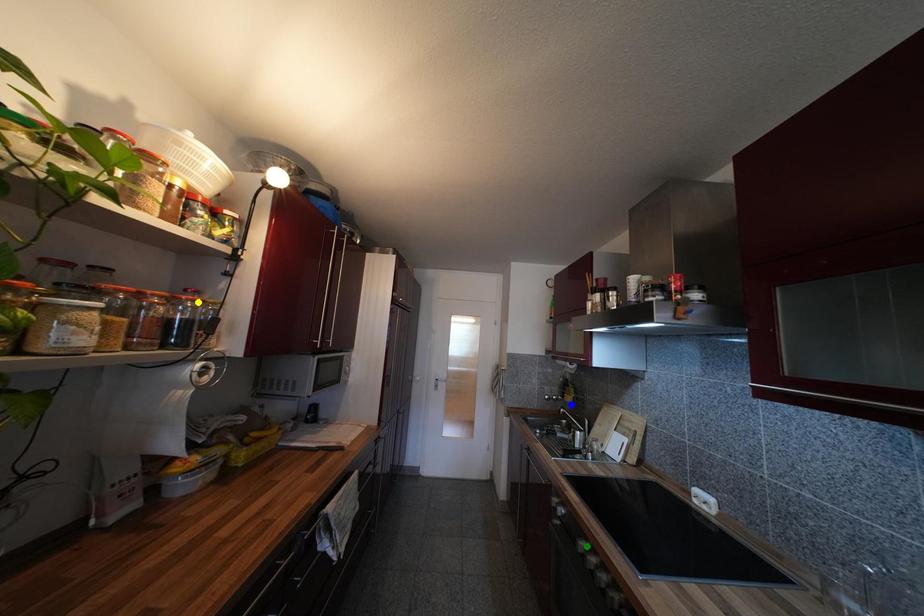
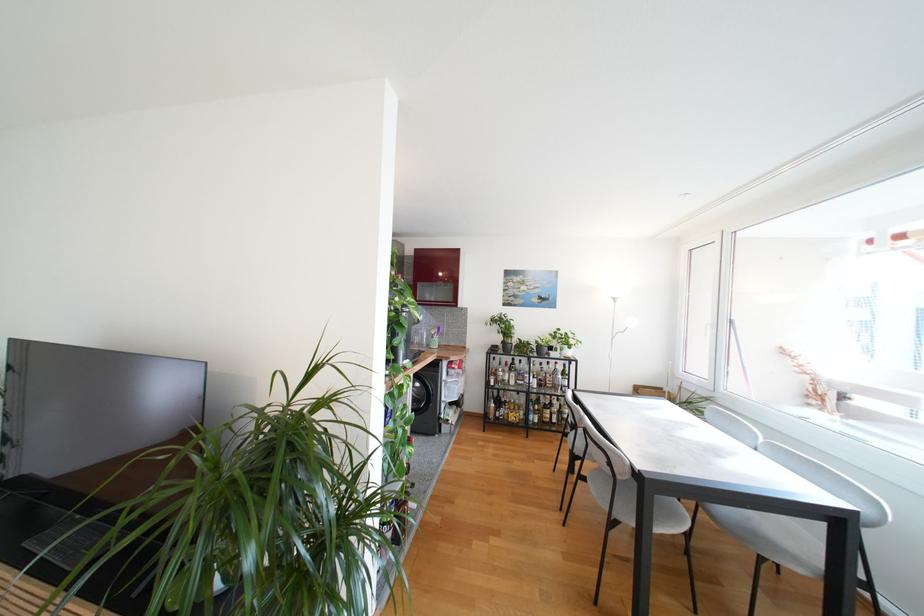
I am providing you with two images of the same scene from different viewpoints. Three points are marked in image1. Which point corresponds to a part or object that is occluded in image2?In image1, three points are marked. Which of them correspond to a part or object that is occluded in image2?Among the three points shown in image1, which one corresponds to a part or object that is no longer visible due to occlusion in image2?

yellow point, blue point, green point